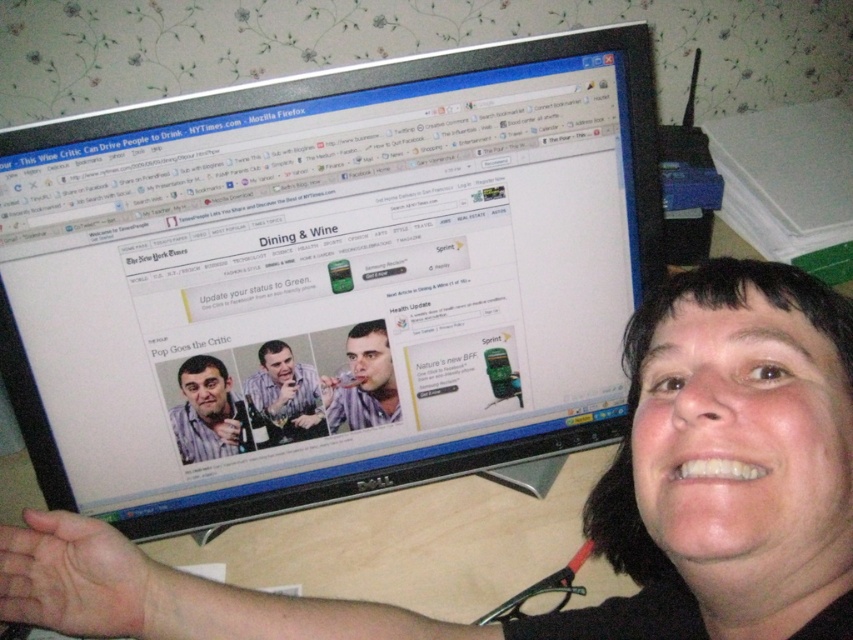
Question: Which is farther from the matte white shirt at center?

Choices:
 (A) black glossy monitor at upper center
 (B) matte black shirt at center
 (C) black matte face at lower right

Answer: (C)

Question: Is black matte face at lower right behind matte white shirt at center?

Choices:
 (A) no
 (B) yes

Answer: (A)

Question: Does black matte face at lower right appear under striped shirt at center?

Choices:
 (A) yes
 (B) no

Answer: (A)

Question: Which point is closer to the camera?

Choices:
 (A) matte white shirt at center
 (B) black glossy monitor at upper center

Answer: (B)

Question: Can you confirm if matte white shirt at center is positioned above matte black shirt at center?

Choices:
 (A) no
 (B) yes

Answer: (B)

Question: Among these points, which one is nearest to the camera?

Choices:
 (A) (747, 419)
 (B) (97, 368)
 (C) (341, 406)

Answer: (A)